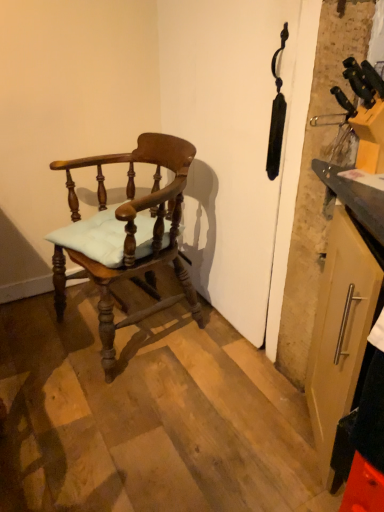
Question: Choose the correct answer: Is matte wood chair at left inside matte silver handle on the right or outside it?

Choices:
 (A) outside
 (B) inside

Answer: (A)

Question: From a real-world perspective, is matte wood chair at left above or below matte silver handle on the right?

Choices:
 (A) below
 (B) above

Answer: (A)

Question: From the image's perspective, relative to matte silver handle on the right, is matte wood chair at left above or below?

Choices:
 (A) above
 (B) below

Answer: (A)

Question: Considering the positions of matte silver handle on the right and matte wood chair at left in the image, is matte silver handle on the right taller or shorter than matte wood chair at left?

Choices:
 (A) short
 (B) tall

Answer: (A)

Question: From the image's perspective, is matte silver handle on the right positioned above or below matte wood chair at left?

Choices:
 (A) above
 (B) below

Answer: (B)

Question: In the image, is matte silver handle on the right positioned in front of or behind matte wood chair at left?

Choices:
 (A) front
 (B) behind

Answer: (A)

Question: Is matte silver handle on the right inside or outside of matte wood chair at left?

Choices:
 (A) outside
 (B) inside

Answer: (A)